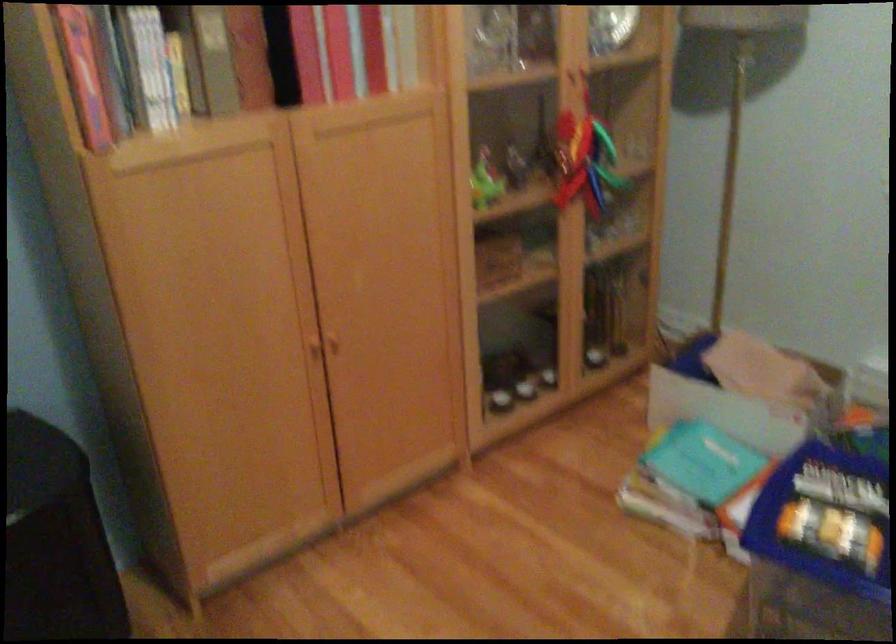
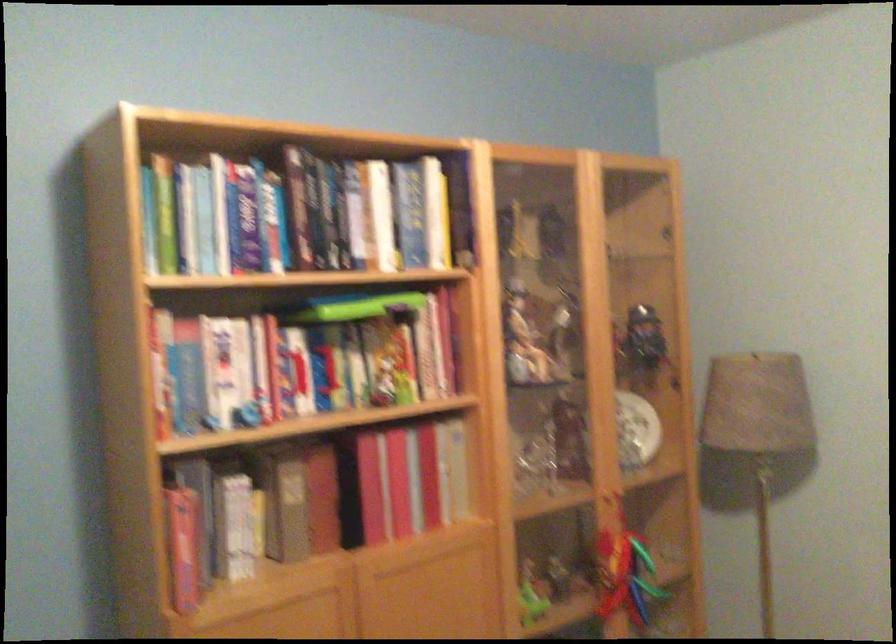
Where in the second image is the point corresponding to (x=90, y=82) from the first image?

(184, 544)